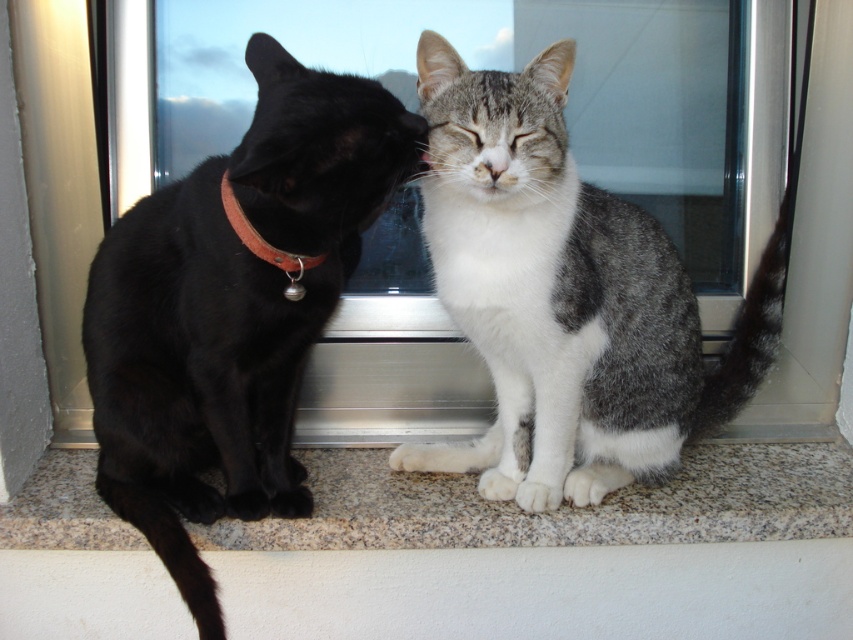
Question: Which point is farther to the camera?

Choices:
 (A) shiny black cat at left
 (B) gray-white fur cat at center
 (C) granite at lower center

Answer: (C)

Question: Considering the relative positions of shiny black cat at left and transparent plastic screen door at left in the image provided, where is shiny black cat at left located with respect to transparent plastic screen door at left?

Choices:
 (A) right
 (B) left

Answer: (A)

Question: Can you confirm if shiny black cat at left is bigger than transparent plastic screen door at left?

Choices:
 (A) no
 (B) yes

Answer: (B)

Question: Can you confirm if granite at lower center is thinner than shiny black cat at left?

Choices:
 (A) yes
 (B) no

Answer: (B)

Question: Which point appears farthest from the camera in this image?

Choices:
 (A) (248, 228)
 (B) (554, 60)
 (C) (86, 492)
 (D) (18, 10)

Answer: (D)

Question: Which point appears farthest from the camera in this image?

Choices:
 (A) pyautogui.click(x=59, y=321)
 (B) pyautogui.click(x=329, y=620)
 (C) pyautogui.click(x=294, y=88)

Answer: (A)